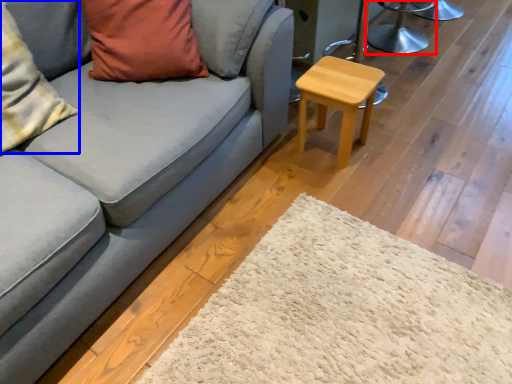
Question: Which point is closer to the camera, swivel chair (highlighted by a red box) or pillow (highlighted by a blue box)?

Choices:
 (A) swivel chair
 (B) pillow

Answer: (B)